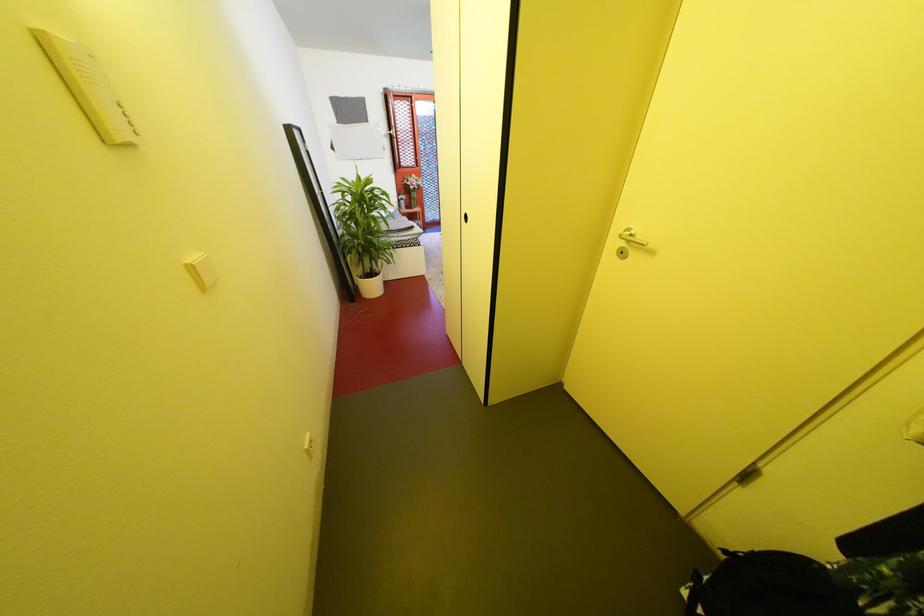
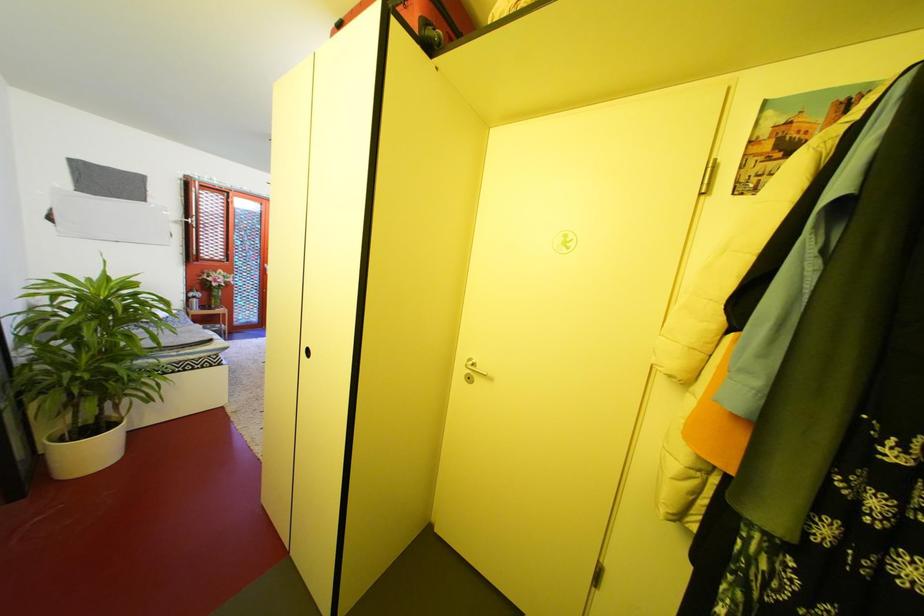
The first image is from the beginning of the video and the second image is from the end. How did the camera likely rotate when shooting the video?

The rotation direction of the camera is right-up.